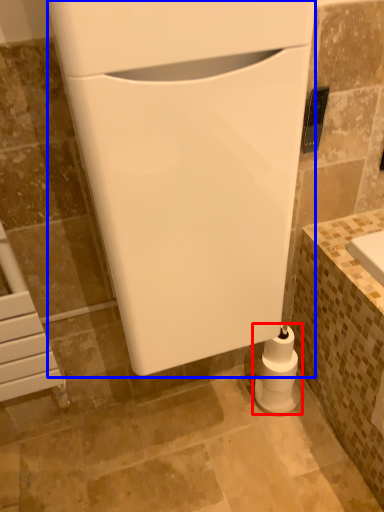
Question: Which object appears closest to the camera in this image, toilet paper (highlighted by a red box) or appliance (highlighted by a blue box)?

Choices:
 (A) toilet paper
 (B) appliance

Answer: (B)